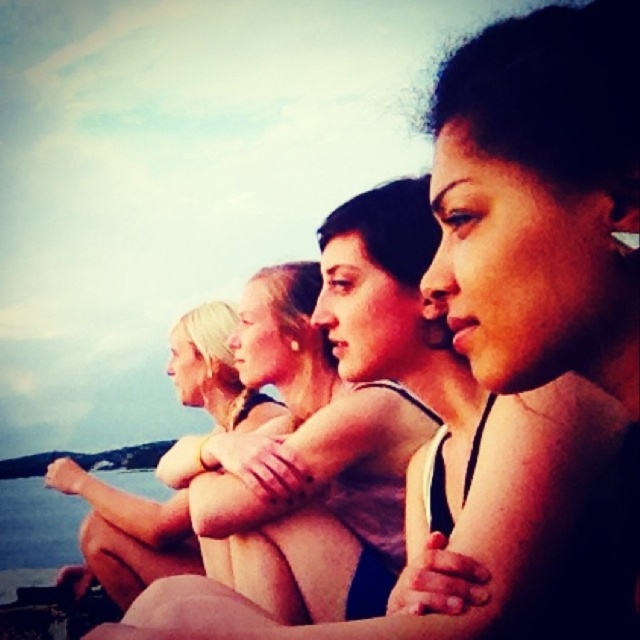
You are a photographer trying to capture a candid shot of the group. You notice a specific point in the image at coordinates (x=134, y=534). What is the most prominent feature at that location?

The point at coordinates (x=134, y=534) marks blonde hair at center, which is the most prominent feature there.

Based on the scene description, where is the blonde hair at center located in the image?

The blonde hair at center is located at point (134, 534).